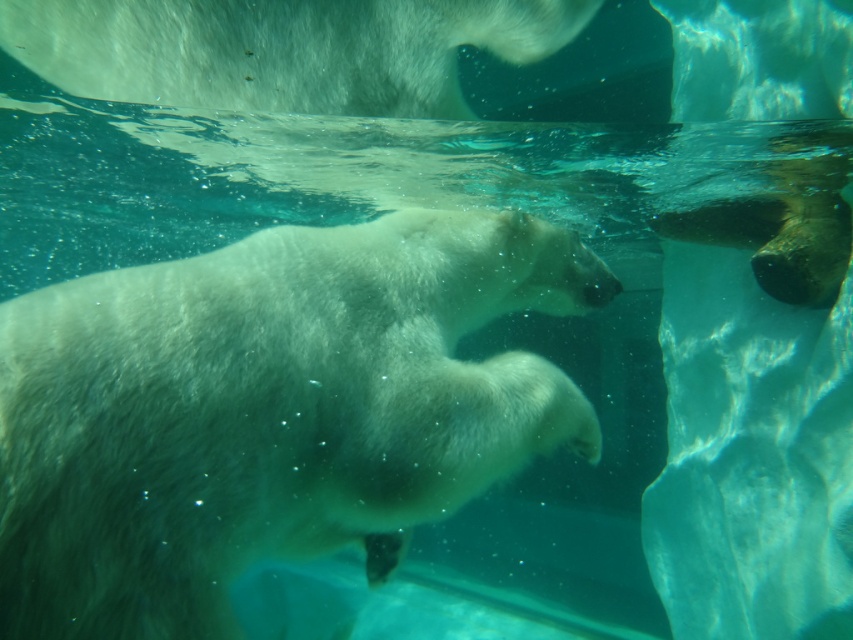
Question: Among these points, which one is nearest to the camera?

Choices:
 (A) (314, 531)
 (B) (236, 93)

Answer: (B)

Question: Is white fur polar bear at center closer to camera compared to white fur polar bear at upper center?

Choices:
 (A) no
 (B) yes

Answer: (B)

Question: Is white fur polar bear at center positioned before white fur polar bear at upper center?

Choices:
 (A) yes
 (B) no

Answer: (A)

Question: Does white fur polar bear at center have a lesser width compared to white fur polar bear at upper center?

Choices:
 (A) no
 (B) yes

Answer: (B)